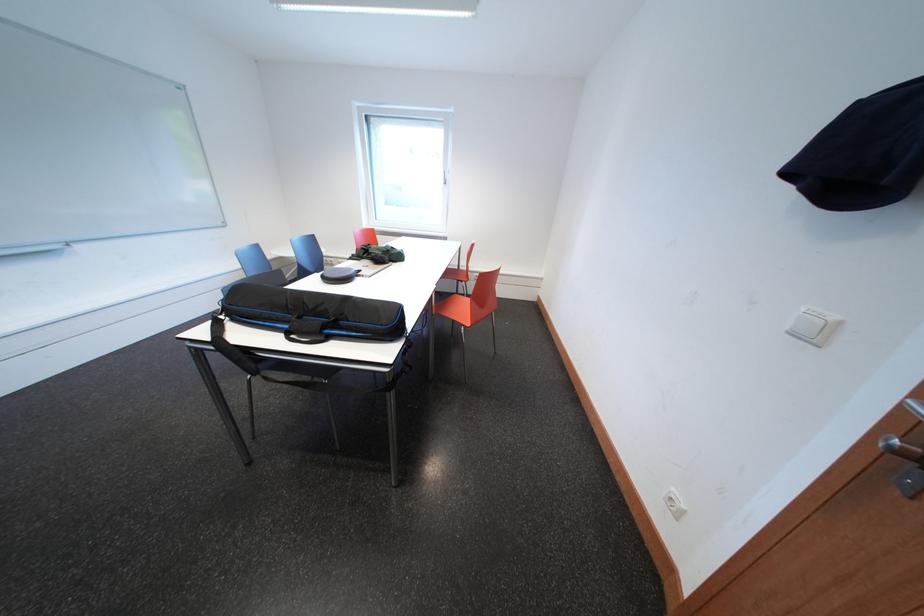
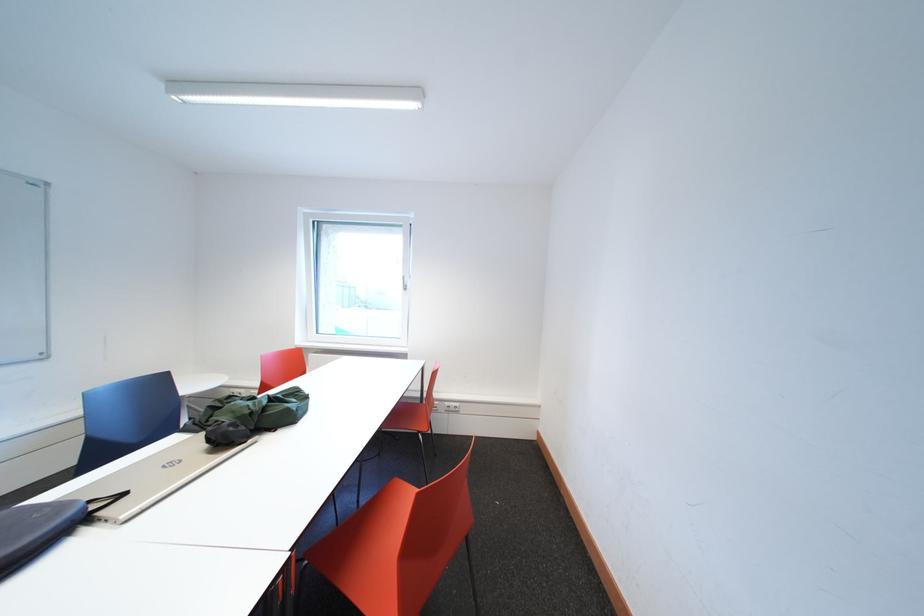
Question: In a continuous first-person perspective shot, in which direction is the camera moving?

Choices:
 (A) Left
 (B) Right
 (C) Forward
 (D) Backward

Answer: (C)